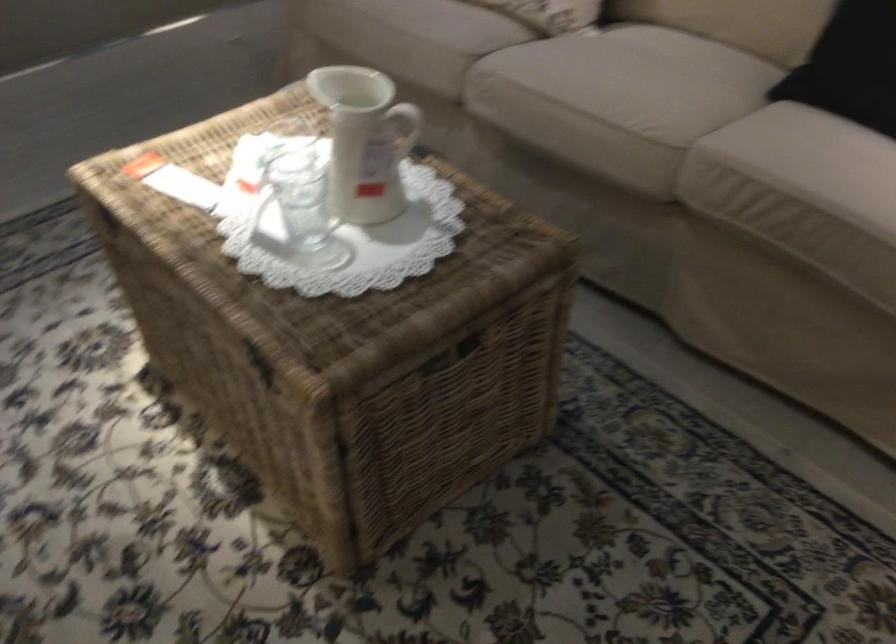
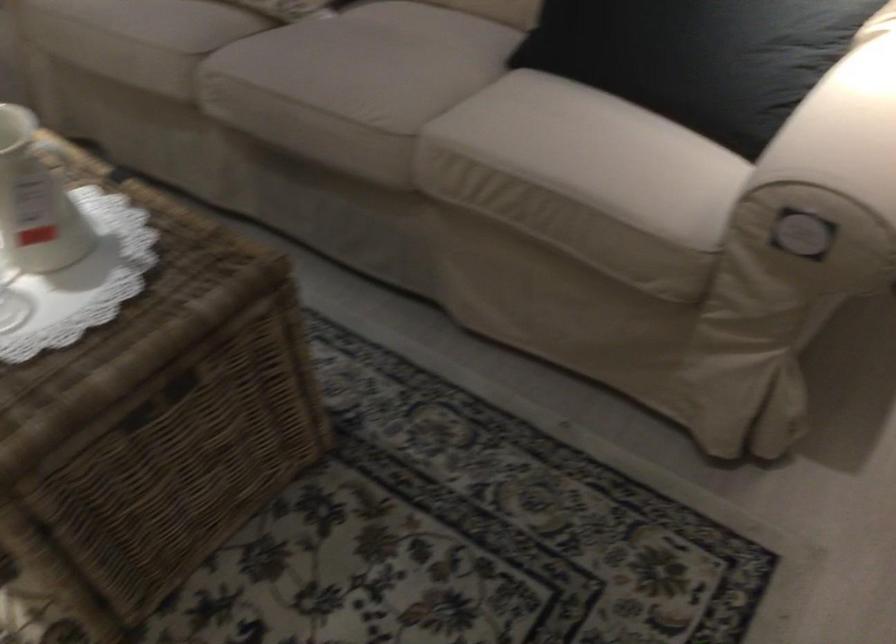
Question: Which direction would the cameraman need to move to produce the second image? Reply with the corresponding letter.

Choices:
 (A) Left
 (B) Right
 (C) Forward
 (D) Backward

Answer: (B)